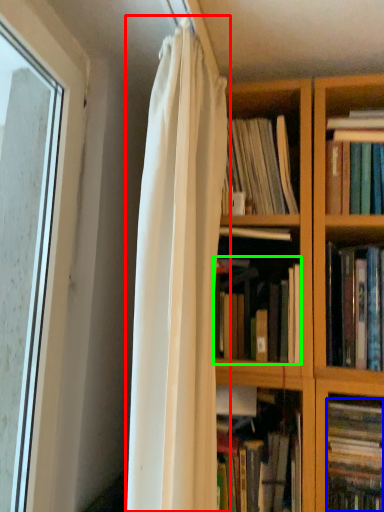
Question: Estimate the real-world distances between objects in this image. Which object is farther from curtain (highlighted by a red box), book (highlighted by a blue box) or book (highlighted by a green box)?

Choices:
 (A) book
 (B) book

Answer: (A)